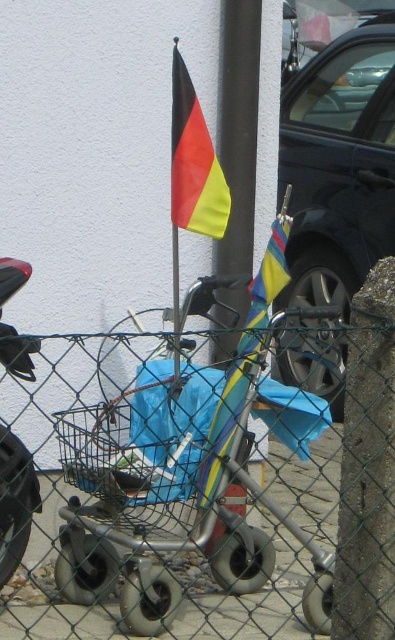
Question: Does shiny black motorcycle at left appear on the right side of polyester flag at center?

Choices:
 (A) yes
 (B) no

Answer: (B)

Question: Can you confirm if matte fabric flag at center is positioned above shiny black motorcycle at left?

Choices:
 (A) yes
 (B) no

Answer: (A)

Question: Where is matte fabric flag at center located in relation to shiny black motorcycle at left in the image?

Choices:
 (A) left
 (B) right

Answer: (B)

Question: Considering the real-world distances, which object is closest to the polyester flag at center?

Choices:
 (A) shiny black car at right
 (B) smooth concrete pavement at lower center
 (C) matte fabric flag at center
 (D) shiny black motorcycle at left

Answer: (C)

Question: Among these objects, which one is farthest from the camera?

Choices:
 (A) shiny black car at right
 (B) shiny black motorcycle at left
 (C) smooth concrete pavement at lower center

Answer: (A)

Question: Which object appears closest to the camera in this image?

Choices:
 (A) smooth concrete pavement at lower center
 (B) shiny black motorcycle at left
 (C) matte fabric flag at center
 (D) shiny black car at right

Answer: (A)